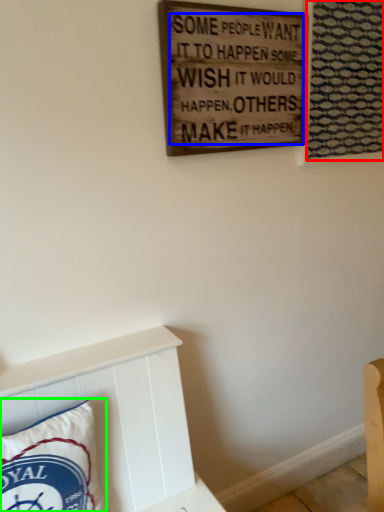
Question: Which object is the farthest from tapestry (highlighted by a red box)? Choose among these: writing (highlighted by a blue box) or pillow (highlighted by a green box).

Choices:
 (A) writing
 (B) pillow

Answer: (B)